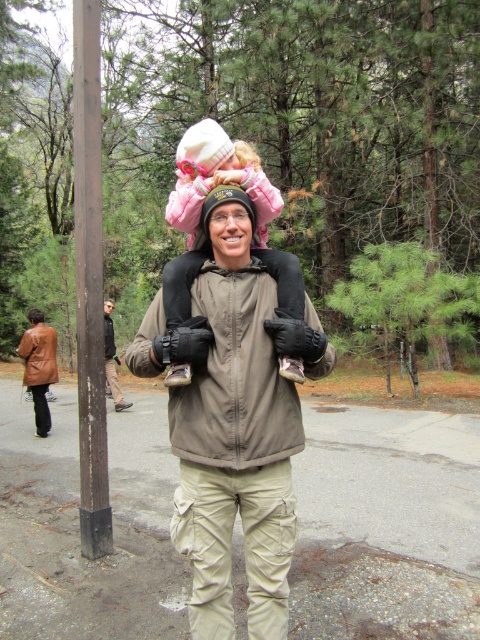
You are a photographer positioned at the center of the scene. You want to take a photo of the brown wood pole at left and the brown leather jacket at center. Which object should you adjust your camera to focus on first if you want to capture both in the frame without moving your position?

The brown wood pole at left is to the right of brown leather jacket at center, so you should focus on the brown leather jacket at center first to ensure both are in the frame.

You are a photographer trying to capture a closeup of the matte pink jacket at upper center without the brown leather jacket at lower left showing in the frame. Is this possible given their positions?

The matte pink jacket at upper center is positioned over the brown leather jacket at lower left, so it is possible to capture a closeup of the matte pink jacket at upper center without the brown leather jacket at lower left showing in the frame by focusing on the upper area where the pink jacket is located.

You are a photographer trying to capture both the matte pink jacket at upper center and the brown leather jacket at lower left in the same frame. Given that your camera has a 50mm lens with a field of view that can capture objects up to 5 meters apart, will you be able to include both subjects in a single photo?

The matte pink jacket at upper center and brown leather jacket at lower left are 6.07 meters apart from each other. Since the camera can only capture up to 5 meters, you won